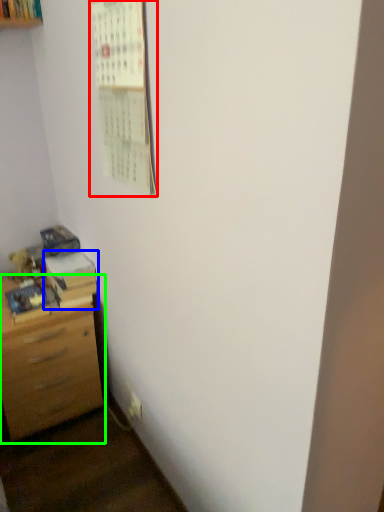
Question: Which object is positioned farthest from bulletin board (highlighted by a red box)? Select from book (highlighted by a blue box) and chest of drawers (highlighted by a green box).

Choices:
 (A) book
 (B) chest of drawers

Answer: (B)